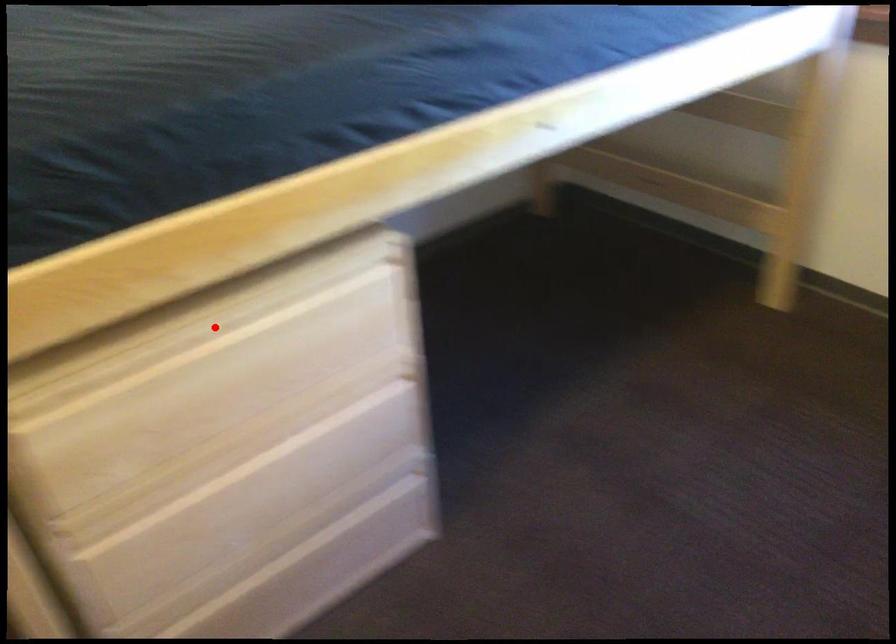
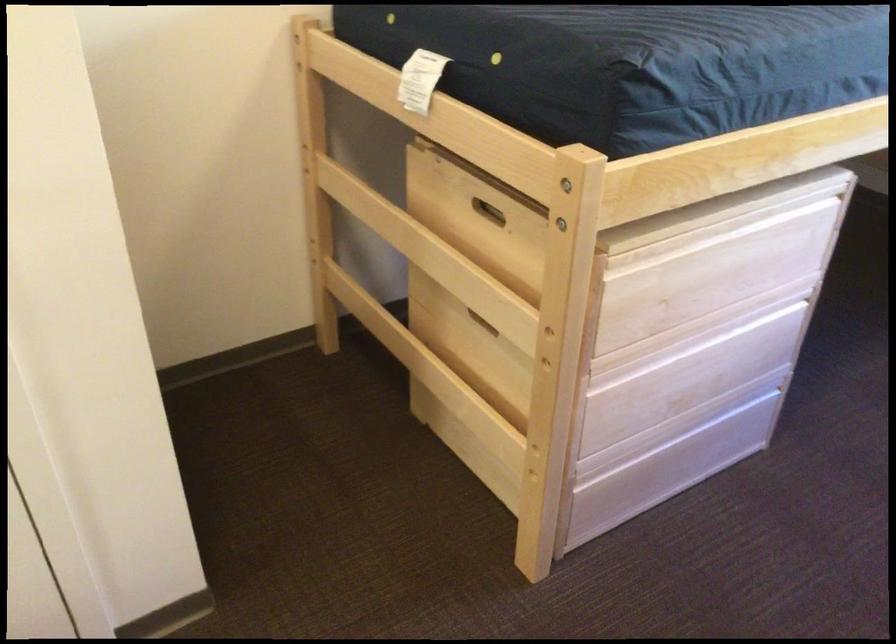
Question: I am providing you with two images of the same scene from different viewpoints. In image1, a red point is highlighted. Considering the same 3D point in image2, which of the following is correct?

Choices:
 (A) It is closer
 (B) It is farther

Answer: (B)